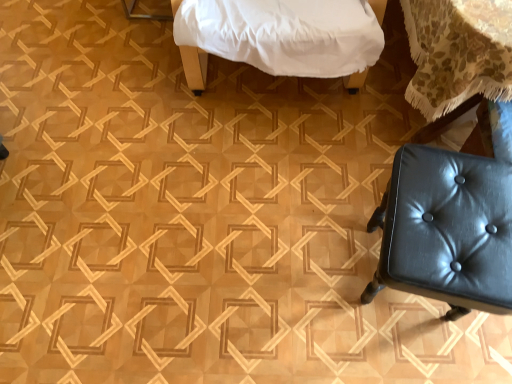
What do you see at coordinates (448, 226) in the screenshot? The image size is (512, 384). I see `black leather stool at lower right` at bounding box center [448, 226].

Locate an element on the screen. The width and height of the screenshot is (512, 384). black leather stool at lower right is located at coordinates 448,226.

In the scene shown: In order to face white fabric-covered bed at upper center, should I rotate leftwards or rightwards?

You should look right and rotate roughly 2.253 degrees.

The image size is (512, 384). What do you see at coordinates (194, 66) in the screenshot? I see `white fabric-covered bed at upper center` at bounding box center [194, 66].

Locate an element on the screen. The height and width of the screenshot is (384, 512). white fabric-covered bed at upper center is located at coordinates (194, 66).

You are a GUI agent. You are given a task and a screenshot of the screen. Output one action in this format:
    pyautogui.click(x=<x>, y=<y>)
    Task: Click on the black leather stool at lower right
    The width and height of the screenshot is (512, 384).
    Given the screenshot: What is the action you would take?
    pyautogui.click(x=448, y=226)

Does white fabric-covered bed at upper center appear on the right side of black leather stool at lower right?

In fact, white fabric-covered bed at upper center is to the left of black leather stool at lower right.

Consider the image. In the image, is white fabric-covered bed at upper center positioned in front of or behind black leather stool at lower right?

In the image, white fabric-covered bed at upper center appears behind black leather stool at lower right.

Is point (202, 85) positioned before point (508, 175)?

No.

From the image's perspective, does white fabric-covered bed at upper center appear higher than black leather stool at lower right?

Yes, from the image's perspective, white fabric-covered bed at upper center is over black leather stool at lower right.

From a real-world perspective, who is located lower, white fabric-covered bed at upper center or black leather stool at lower right?

From a 3D spatial view, black leather stool at lower right is below.

Is white fabric-covered bed at upper center thinner than black leather stool at lower right?

Incorrect, the width of white fabric-covered bed at upper center is not less than that of black leather stool at lower right.

Considering the sizes of white fabric-covered bed at upper center and black leather stool at lower right in the image, is white fabric-covered bed at upper center taller or shorter than black leather stool at lower right?

In the image, white fabric-covered bed at upper center appears to be taller than black leather stool at lower right.

Can you confirm if white fabric-covered bed at upper center is smaller than black leather stool at lower right?

Incorrect, white fabric-covered bed at upper center is not smaller in size than black leather stool at lower right.

Would you say white fabric-covered bed at upper center is inside or outside black leather stool at lower right?

white fabric-covered bed at upper center is outside black leather stool at lower right.

Is there a large distance between white fabric-covered bed at upper center and black leather stool at lower right?

That's not correct — white fabric-covered bed at upper center is a little close to black leather stool at lower right.

Is white fabric-covered bed at upper center facing away from black leather stool at lower right?

white fabric-covered bed at upper center does not have its back to black leather stool at lower right.

Measure the distance from white fabric-covered bed at upper center to black leather stool at lower right.

white fabric-covered bed at upper center is 96.67 centimeters from black leather stool at lower right.

Find the location of a particular element. This screenshot has width=512, height=384. furniture on the left of black leather stool at lower right is located at coordinates (194, 66).

Which is more to the right, black leather stool at lower right or white fabric-covered bed at upper center?

From the viewer's perspective, black leather stool at lower right appears more on the right side.

Which object is closer to the camera taking this photo, black leather stool at lower right or white fabric-covered bed at upper center?

black leather stool at lower right is closer to the camera.

Considering the positions of point (433, 182) and point (191, 66), is point (433, 182) closer or farther from the camera than point (191, 66)?

Point (433, 182) appears to be closer to the viewer than point (191, 66).

From the image's perspective, is black leather stool at lower right located above white fabric-covered bed at upper center?

No, from the image's perspective, black leather stool at lower right is not above white fabric-covered bed at upper center.

From a real-world perspective, who is located higher, black leather stool at lower right or white fabric-covered bed at upper center?

white fabric-covered bed at upper center.

Which object is wider, black leather stool at lower right or white fabric-covered bed at upper center?

Wider between the two is white fabric-covered bed at upper center.

Who is taller, black leather stool at lower right or white fabric-covered bed at upper center?

white fabric-covered bed at upper center.

Based on the photo, does black leather stool at lower right have a smaller size compared to white fabric-covered bed at upper center?

Indeed, black leather stool at lower right has a smaller size compared to white fabric-covered bed at upper center.

Would you say black leather stool at lower right is inside or outside white fabric-covered bed at upper center?

black leather stool at lower right is not enclosed by white fabric-covered bed at upper center.

Are black leather stool at lower right and white fabric-covered bed at upper center far apart?

black leather stool at lower right is near white fabric-covered bed at upper center, not far away.

Does black leather stool at lower right turn towards white fabric-covered bed at upper center?

No.

Locate an element on the screen. chair on the right side of white fabric-covered bed at upper center is located at coordinates (448, 226).

Find the location of a particular element. furniture behind the black leather stool at lower right is located at coordinates (194, 66).

This screenshot has width=512, height=384. Find the location of `furniture that is above the black leather stool at lower right (from the image's perspective)`. furniture that is above the black leather stool at lower right (from the image's perspective) is located at coordinates (194, 66).